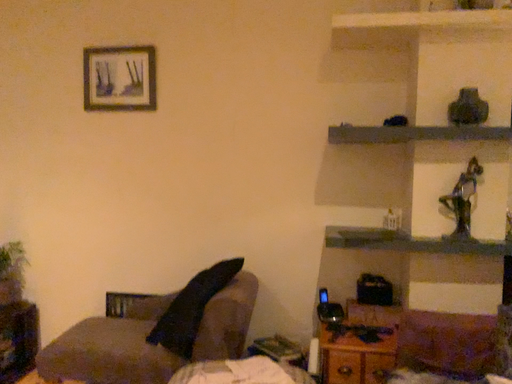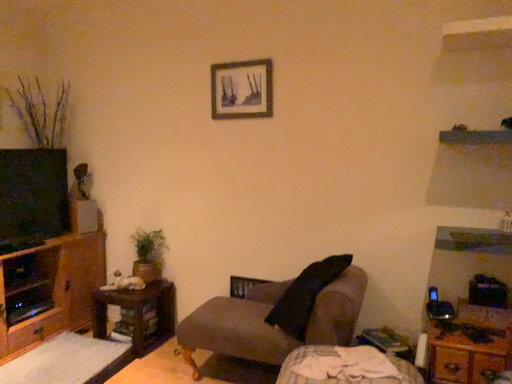
Question: Which way did the camera rotate in the video?

Choices:
 (A) rotated left
 (B) rotated right

Answer: (A)